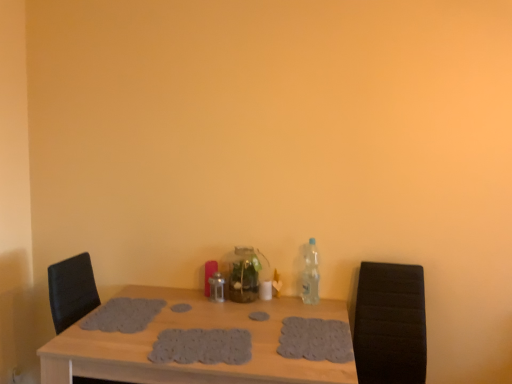
Find the location of a particular element. blank space above gray knitted placemat at center, the third footprint viewed from the right (from a real-world perspective) is located at coordinates (207, 344).